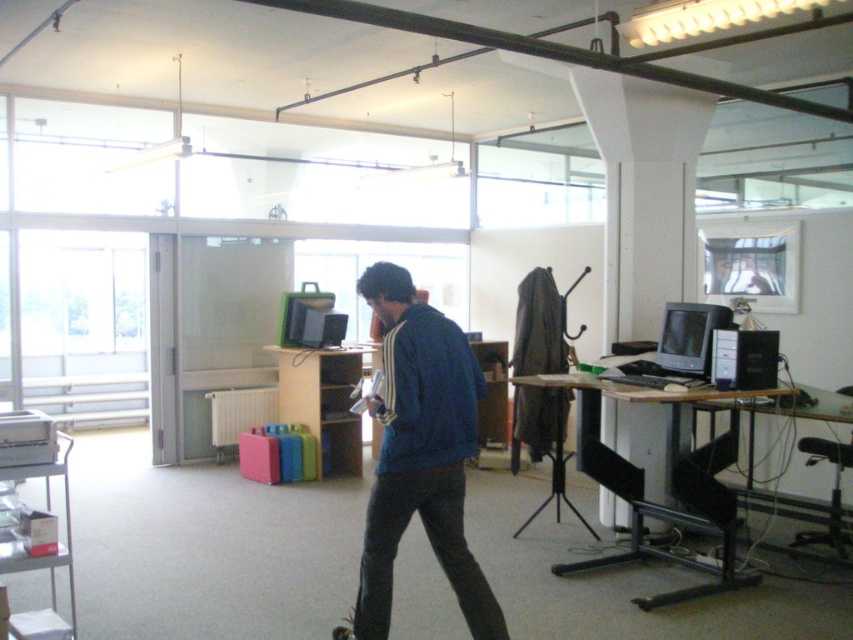
Is blue fabric jacket at center bigger than metallic silver skateboard at lower center?

Yes.

Identify the location of blue fabric jacket at center. The width and height of the screenshot is (853, 640). (421, 452).